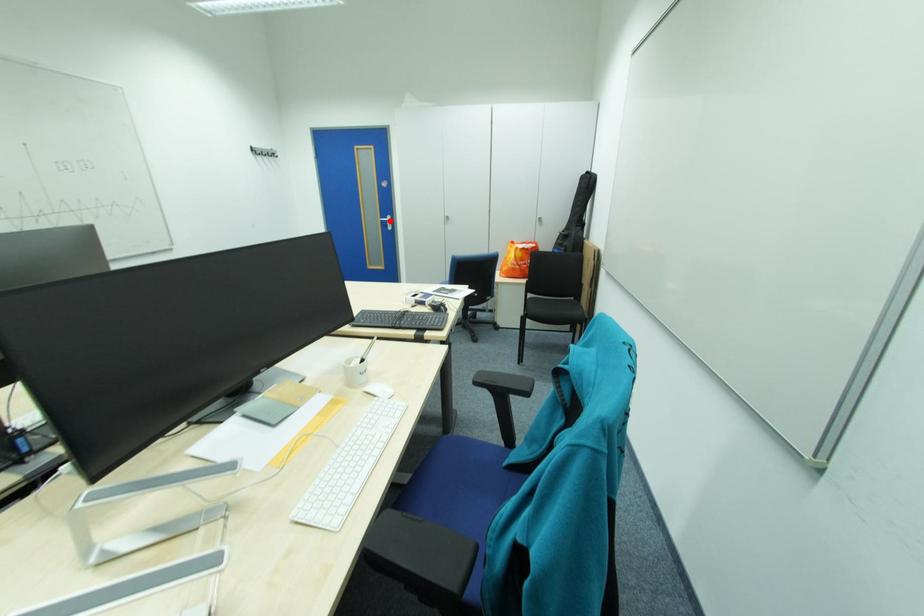
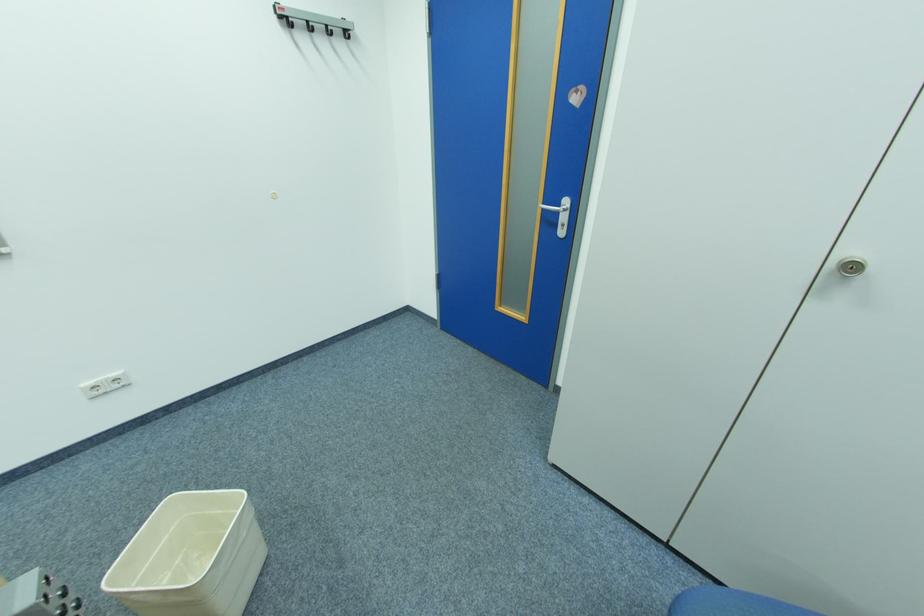
Find the pixel in the second image that matches the highlighted location in the first image.

(552, 209)